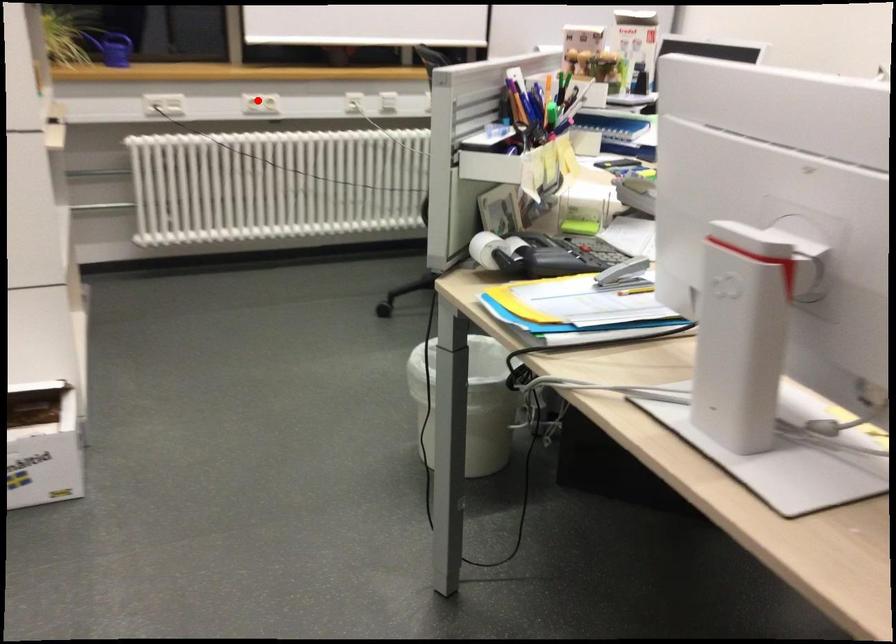
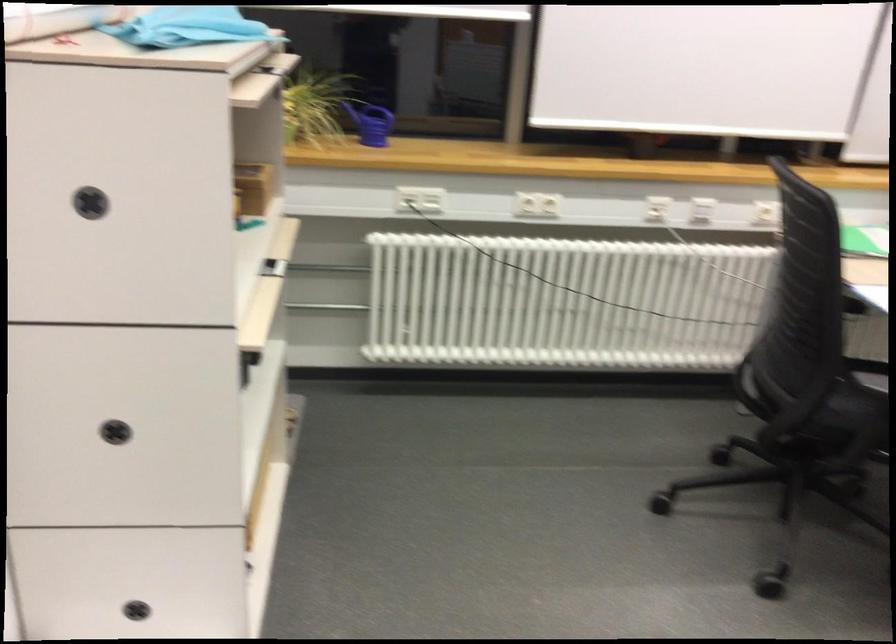
In the second image, find the point that corresponds to the highlighted location in the first image.

(537, 205)